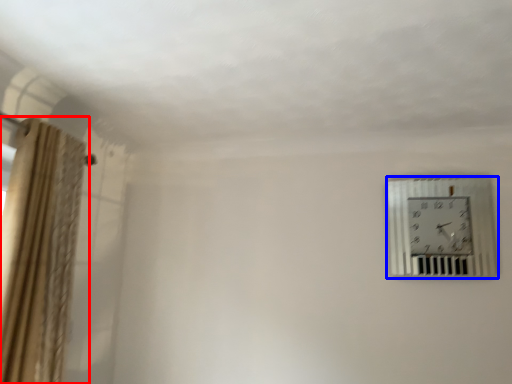
Question: Which point is closer to the camera, curtain (highlighted by a red box) or wall clock (highlighted by a blue box)?

Choices:
 (A) curtain
 (B) wall clock

Answer: (A)